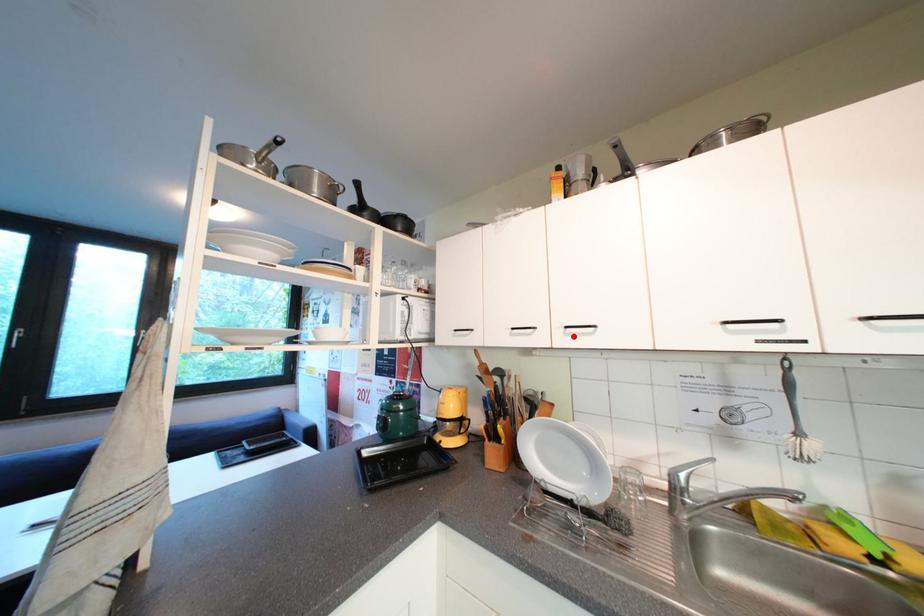
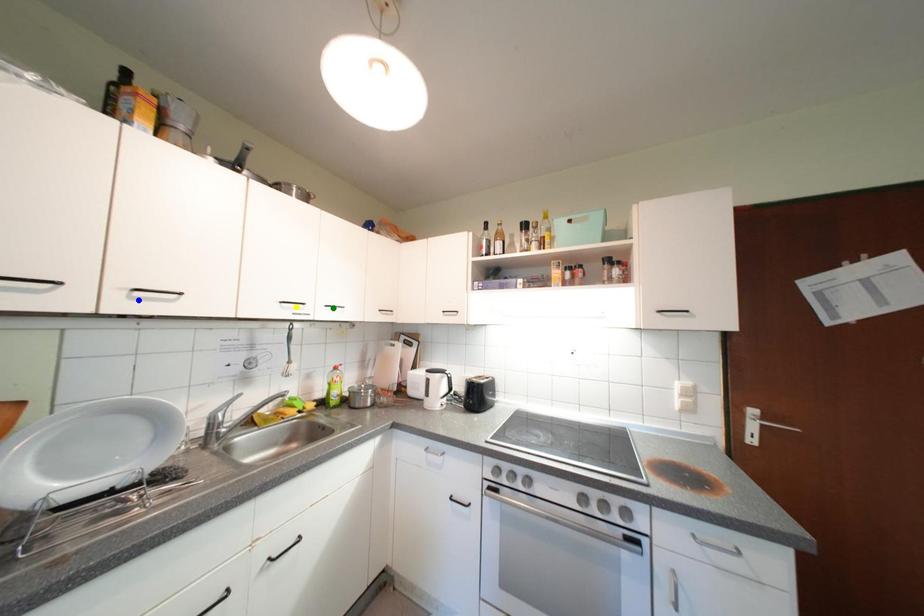
Question: I am providing you with two images of the same scene from different viewpoints. A red point is marked on the first image. You are given multiple points on the second image. In image 2, which mark is for the same physical point as the one in image 1?

Choices:
 (A) yellow point
 (B) green point
 (C) blue point

Answer: (C)